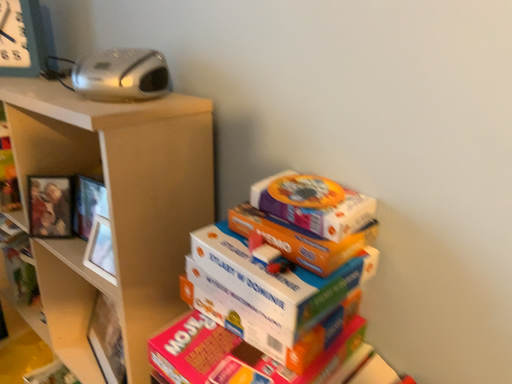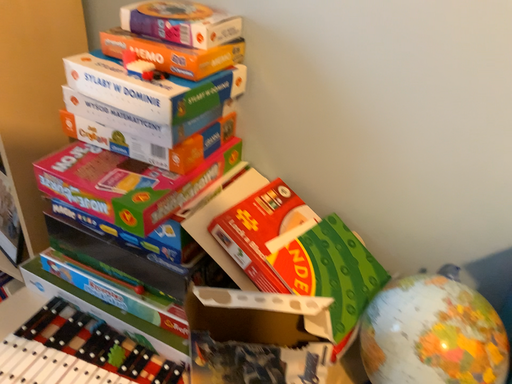
Question: How did the camera likely rotate when shooting the video?

Choices:
 (A) rotated right
 (B) rotated left

Answer: (A)